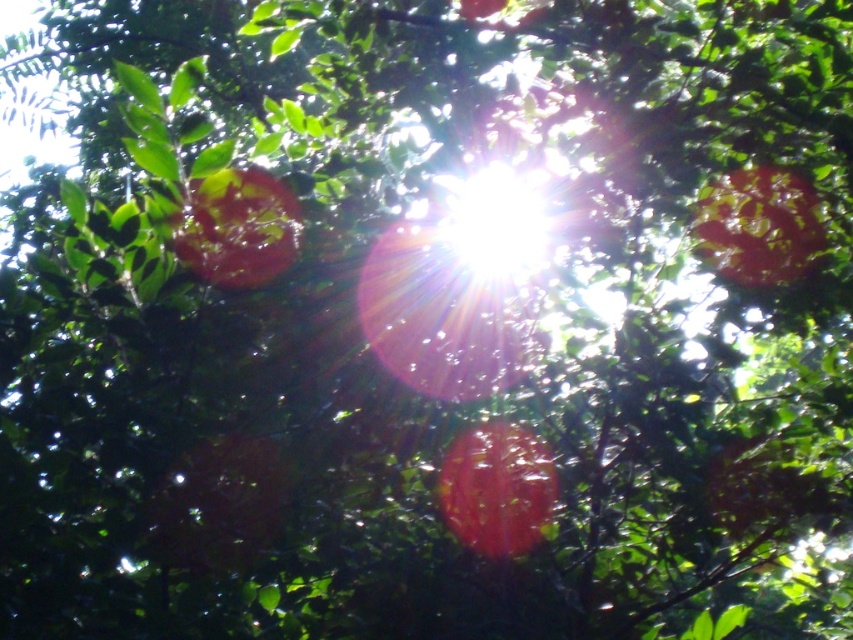
Who is shorter, glossy red apple at center or glossy red apple at upper right?

glossy red apple at upper right

Between glossy red apple at center and glossy red apple at upper right, which one is positioned lower?

Positioned lower is glossy red apple at center.

Is point (544, 483) in front of point (782, 186)?

Yes, point (544, 483) is closer to viewer.

The image size is (853, 640). I want to click on glossy red apple at center, so click(497, 488).

Is glossy red apple at center below glossy red apple at upper left?

Correct, glossy red apple at center is located below glossy red apple at upper left.

Does glossy red apple at center have a lesser height compared to glossy red apple at upper left?

No.

Between point (485, 442) and point (221, 237), which one is positioned in front?

Point (221, 237)

In order to click on glossy red apple at center in this screenshot , I will do `click(497, 488)`.

Can you confirm if glossy red apple at upper right is thinner than glossy red apple at upper left?

No, glossy red apple at upper right is not thinner than glossy red apple at upper left.

Can you confirm if glossy red apple at upper right is shorter than glossy red apple at upper left?

In fact, glossy red apple at upper right may be taller than glossy red apple at upper left.

What do you see at coordinates (758, 225) in the screenshot?
I see `glossy red apple at upper right` at bounding box center [758, 225].

Locate an element on the screen. The height and width of the screenshot is (640, 853). glossy red apple at upper right is located at coordinates (758, 225).